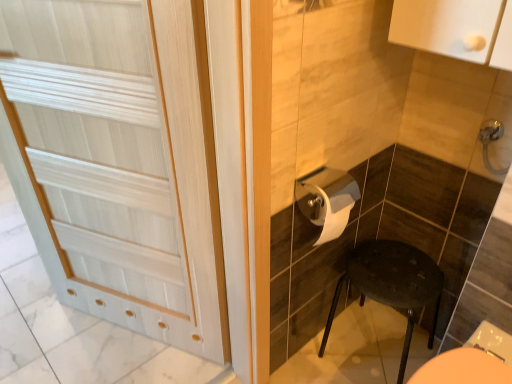
Question: Does white glossy toilet paper at center have a greater width compared to satin nickel faucet at upper right?

Choices:
 (A) no
 (B) yes

Answer: (B)

Question: Is white glossy toilet paper at center positioned before satin nickel faucet at upper right?

Choices:
 (A) no
 (B) yes

Answer: (B)

Question: Is white glossy toilet paper at center next to satin nickel faucet at upper right and touching it?

Choices:
 (A) no
 (B) yes

Answer: (A)

Question: Is white glossy toilet paper at center oriented away from satin nickel faucet at upper right?

Choices:
 (A) yes
 (B) no

Answer: (B)

Question: Considering the relative sizes of white glossy toilet paper at center and satin nickel faucet at upper right in the image provided, is white glossy toilet paper at center bigger than satin nickel faucet at upper right?

Choices:
 (A) yes
 (B) no

Answer: (A)

Question: In the image, is white wood door at left positioned in front of or behind white glossy toilet paper at center?

Choices:
 (A) behind
 (B) front

Answer: (B)

Question: From the image's perspective, is white wood door at left above or below white glossy toilet paper at center?

Choices:
 (A) above
 (B) below

Answer: (A)

Question: Considering the positions of white wood door at left and white glossy toilet paper at center in the image, is white wood door at left bigger or smaller than white glossy toilet paper at center?

Choices:
 (A) big
 (B) small

Answer: (A)

Question: Would you say white wood door at left is inside or outside white glossy toilet paper at center?

Choices:
 (A) outside
 (B) inside

Answer: (A)

Question: From the image's perspective, is satin nickel faucet at upper right positioned above or below white wood door at left?

Choices:
 (A) below
 (B) above

Answer: (B)

Question: From a real-world perspective, is satin nickel faucet at upper right physically located above or below white wood door at left?

Choices:
 (A) below
 (B) above

Answer: (B)

Question: Is satin nickel faucet at upper right bigger or smaller than white wood door at left?

Choices:
 (A) big
 (B) small

Answer: (B)

Question: Considering the positions of satin nickel faucet at upper right and white wood door at left in the image, is satin nickel faucet at upper right taller or shorter than white wood door at left?

Choices:
 (A) short
 (B) tall

Answer: (A)

Question: From a real-world perspective, is white wood door at left physically located above or below satin nickel faucet at upper right?

Choices:
 (A) above
 (B) below

Answer: (B)

Question: Is white wood door at left in front of or behind satin nickel faucet at upper right in the image?

Choices:
 (A) behind
 (B) front

Answer: (B)